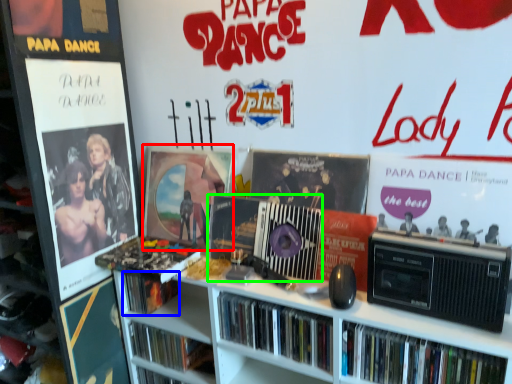
Question: Based on their relative distances, which object is nearer to poster page (highlighted by a red box)? Choose from book (highlighted by a blue box) and cassette (highlighted by a green box).

Choices:
 (A) book
 (B) cassette

Answer: (B)